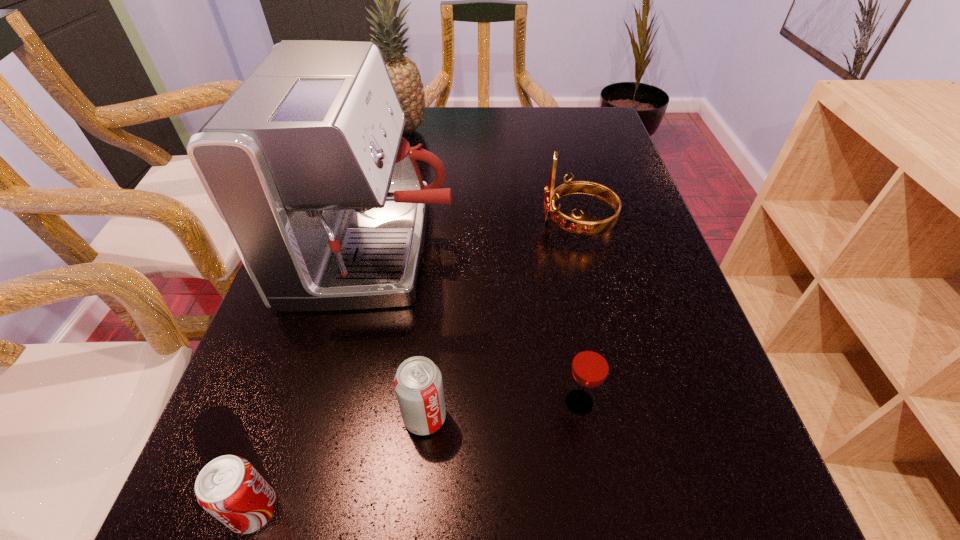
Where is `pineapple`? The width and height of the screenshot is (960, 540). pineapple is located at coordinates (405, 76).

The height and width of the screenshot is (540, 960). Find the location of `coffee maker`. coffee maker is located at coordinates (305, 164).

Locate an element on the screen. The image size is (960, 540). the fourth shortest object is located at coordinates (575, 225).

Find the location of a particular element. glass is located at coordinates (590, 366).

The height and width of the screenshot is (540, 960). What are the coordinates of `the farther soda can` in the screenshot? It's located at (418, 384).

Image resolution: width=960 pixels, height=540 pixels. What are the coordinates of `the nearest object` in the screenshot? It's located at (229, 488).

This screenshot has width=960, height=540. Find the location of `the left soda can`. the left soda can is located at coordinates (229, 488).

At what (x,y) coordinates should I click in order to perform the action: click on blank space located 0.270m on the right of the pineapple. Please return your answer as a coordinate pair (x, y). This screenshot has height=540, width=960. Looking at the image, I should click on [x=516, y=132].

Identify the location of vacant region located 0.390m on the front of the coffee maker near the spout. (633, 249).

The height and width of the screenshot is (540, 960). I want to click on free spot located 0.090m on the front-facing side of the tiara, so click(x=502, y=223).